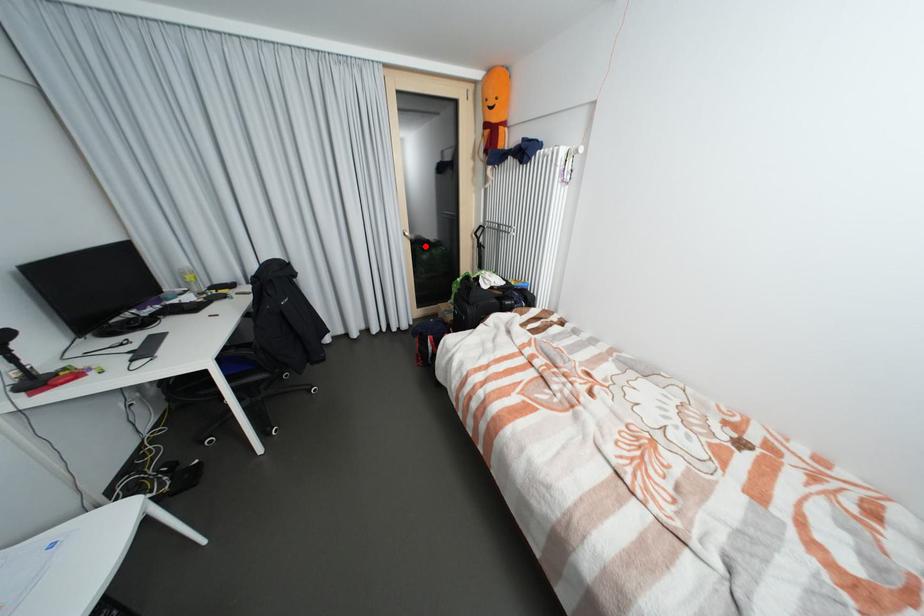
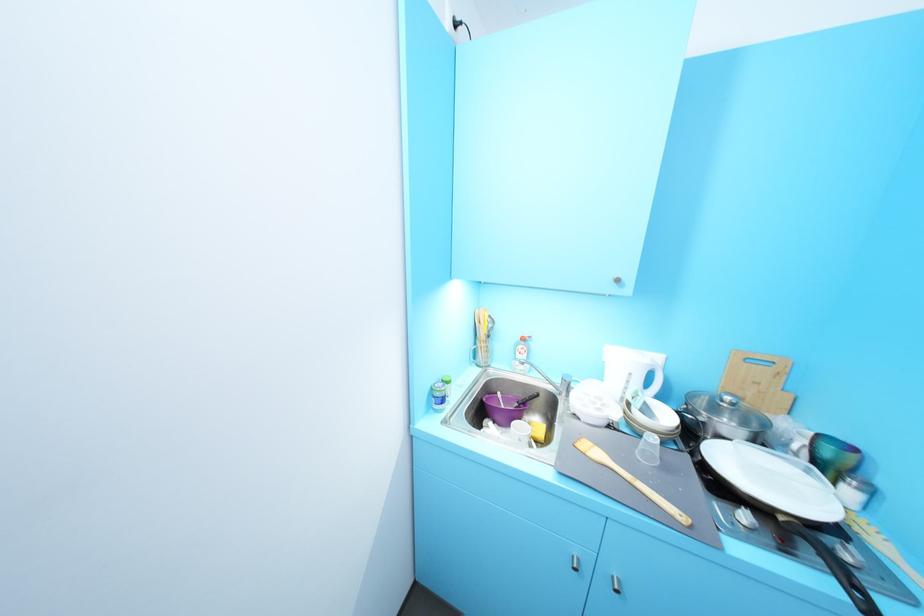
Question: I am providing you with two images of the same scene from different viewpoints. A red point is marked on the first image. Can you still see the location of the red point in image 2?

Choices:
 (A) Yes
 (B) No

Answer: (B)